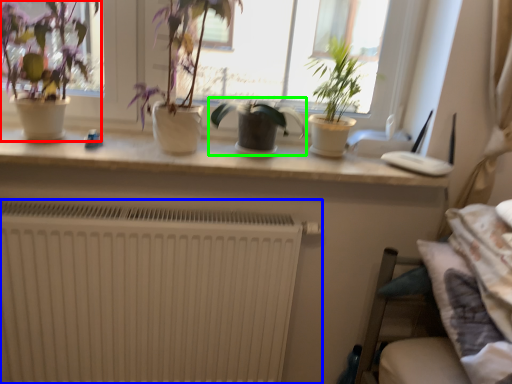
Question: Which object is the farthest from houseplant (highlighted by a red box)? Choose among these: radiator (highlighted by a blue box) or houseplant (highlighted by a green box).

Choices:
 (A) radiator
 (B) houseplant

Answer: (A)